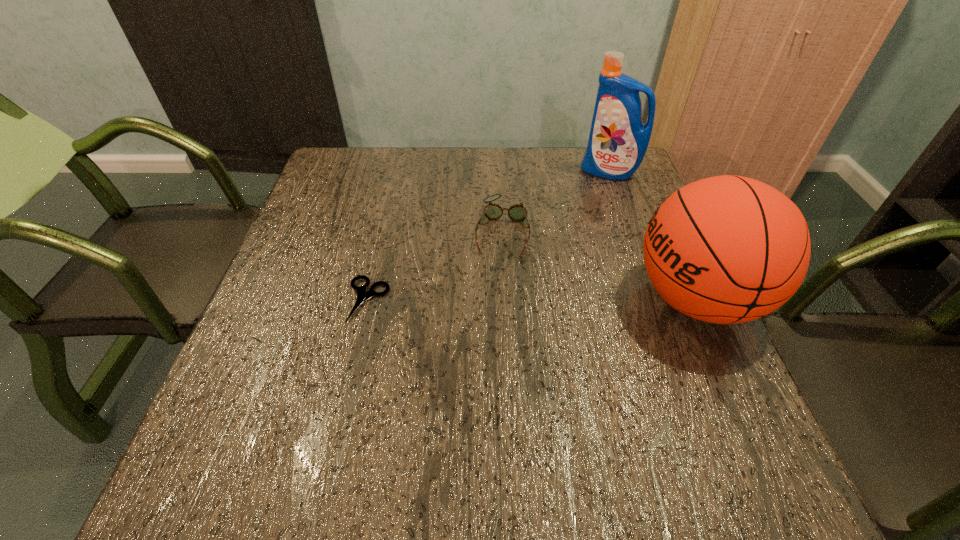
This screenshot has width=960, height=540. I want to click on the leftmost object, so click(x=362, y=295).

The width and height of the screenshot is (960, 540). Find the location of `the shortest object`. the shortest object is located at coordinates (362, 295).

Find the location of a particular element. The image size is (960, 540). basketball is located at coordinates (728, 249).

At what (x,y) coordinates should I click in order to perform the action: click on the farthest object. Please return your answer as a coordinate pair (x, y). This screenshot has height=540, width=960. Looking at the image, I should click on (618, 140).

Locate an element on the screen. Image resolution: width=960 pixels, height=540 pixels. spectacles is located at coordinates (517, 213).

Where is `the third object from right to left`? Image resolution: width=960 pixels, height=540 pixels. the third object from right to left is located at coordinates (517, 213).

Where is `vacant area situated on the right of the shortest object`? Image resolution: width=960 pixels, height=540 pixels. vacant area situated on the right of the shortest object is located at coordinates (445, 300).

I want to click on blank space located 0.330m on the side with logo of the basketball, so click(473, 299).

Locate an element on the screen. vacant position located on the side with logo of the basketball is located at coordinates click(483, 299).

Image resolution: width=960 pixels, height=540 pixels. I want to click on free region located on the side with logo of the basketball, so click(x=549, y=299).